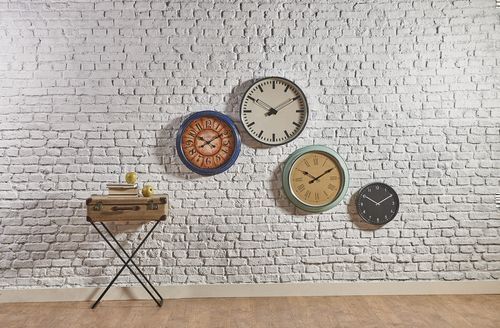
Locate an element on the screen. Image resolution: width=500 pixels, height=328 pixels. circular wall clocks is located at coordinates (204, 143), (268, 111), (319, 177), (379, 207).